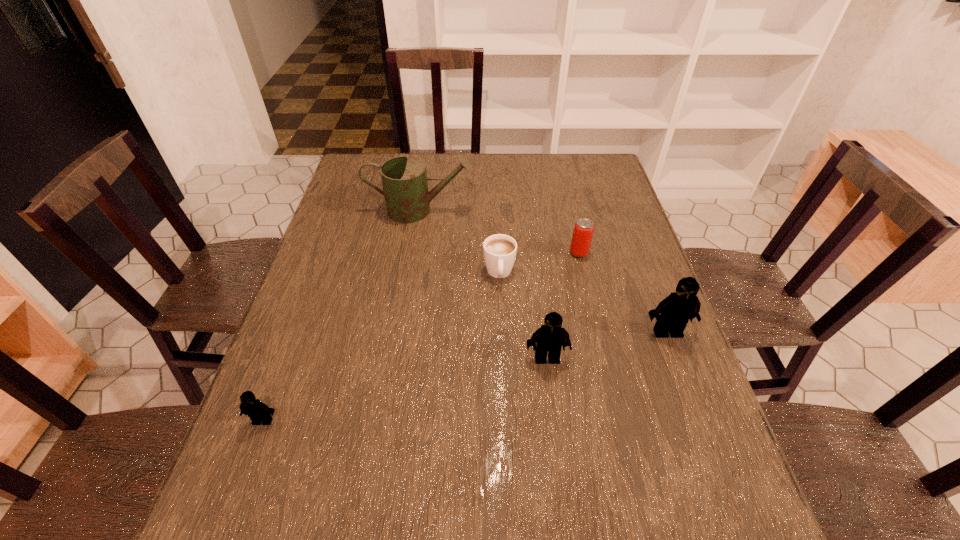
If the aim is uniform spacing by inserting an additional Lego among them, please point to a vacant space for this new Lego. Please provide its 2D coordinates. Your answer should be formatted as a tuple, i.e. [(x, y)], where the tuple contains the x and y coordinates of a point satisfying the conditions above.

[(413, 388)]